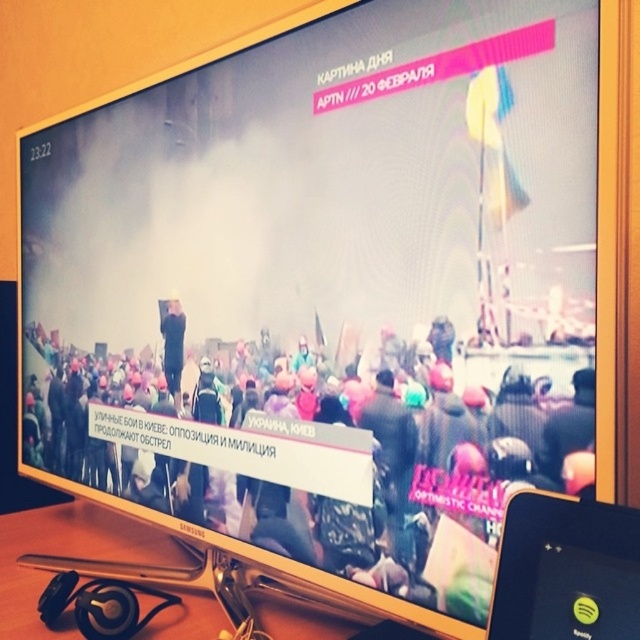
Question: Estimate the real-world distances between objects in this image. Which object is farther from the matte black phone at lower right?

Choices:
 (A) multicolored fabric crowd at center
 (B) dark blue uniform at center

Answer: (B)

Question: Which point is closer to the camera?

Choices:
 (A) matte black phone at lower right
 (B) multicolored fabric crowd at center

Answer: (A)

Question: Which point is farther to the camera?

Choices:
 (A) (168, 316)
 (B) (586, 540)

Answer: (A)

Question: In this image, where is multicolored fabric crowd at center located relative to dark blue uniform at center?

Choices:
 (A) right
 (B) left

Answer: (A)

Question: Where is multicolored fabric crowd at center located in relation to dark blue uniform at center in the image?

Choices:
 (A) below
 (B) above

Answer: (A)

Question: Is multicolored fabric crowd at center to the left of dark blue uniform at center from the viewer's perspective?

Choices:
 (A) no
 (B) yes

Answer: (A)